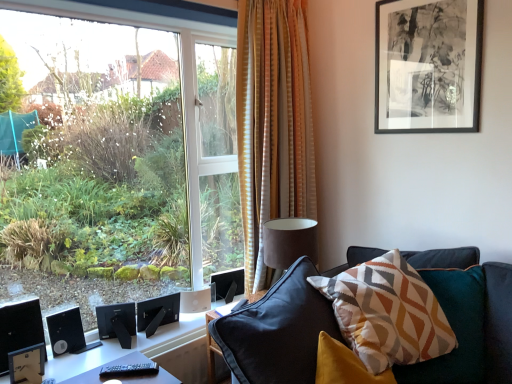
Question: From a real-world perspective, does black matte picture frame at upper right stand above black matte speaker at lower left, arranged as the 3th speaker when viewed from the right?

Choices:
 (A) no
 (B) yes

Answer: (B)

Question: Is black matte picture frame at upper right wider than black matte speaker at lower left, arranged as the 3th speaker when viewed from the right?

Choices:
 (A) no
 (B) yes

Answer: (B)

Question: From the image's perspective, is black matte picture frame at upper right on top of black matte speaker at lower left, which is the 1th speaker in left-to-right order?

Choices:
 (A) yes
 (B) no

Answer: (A)

Question: Does black matte picture frame at upper right come behind black matte speaker at lower left, which is the 1th speaker in left-to-right order?

Choices:
 (A) no
 (B) yes

Answer: (A)

Question: Could you tell me if black matte picture frame at upper right is turned towards black matte speaker at lower left, which is the 1th speaker in left-to-right order?

Choices:
 (A) yes
 (B) no

Answer: (B)

Question: From the image's perspective, is black matte picture frame at upper right beneath black matte speaker at lower left, arranged as the 3th speaker when viewed from the right?

Choices:
 (A) no
 (B) yes

Answer: (A)

Question: Does striped fabric curtain at center have a lesser width compared to black matte speaker at lower left, acting as the 1th speaker starting from the right?

Choices:
 (A) yes
 (B) no

Answer: (B)

Question: Is striped fabric curtain at center looking in the opposite direction of black matte speaker at lower left, acting as the 1th speaker starting from the right?

Choices:
 (A) yes
 (B) no

Answer: (B)

Question: Does striped fabric curtain at center lie behind black matte speaker at lower left, which is the 3th speaker from left to right?

Choices:
 (A) yes
 (B) no

Answer: (B)

Question: Is striped fabric curtain at center taller than black matte speaker at lower left, acting as the 1th speaker starting from the right?

Choices:
 (A) yes
 (B) no

Answer: (A)

Question: Is striped fabric curtain at center positioned before black matte speaker at lower left, which is the 3th speaker from left to right?

Choices:
 (A) no
 (B) yes

Answer: (B)

Question: Does striped fabric curtain at center turn towards black matte speaker at lower left, which is the 3th speaker from left to right?

Choices:
 (A) no
 (B) yes

Answer: (A)

Question: Considering the relative sizes of black matte speaker at lower left, which is the 3th speaker from left to right, and geometric-patterned fabric pillow at center-right in the image provided, is black matte speaker at lower left, which is the 3th speaker from left to right, smaller than geometric-patterned fabric pillow at center-right?

Choices:
 (A) no
 (B) yes

Answer: (B)